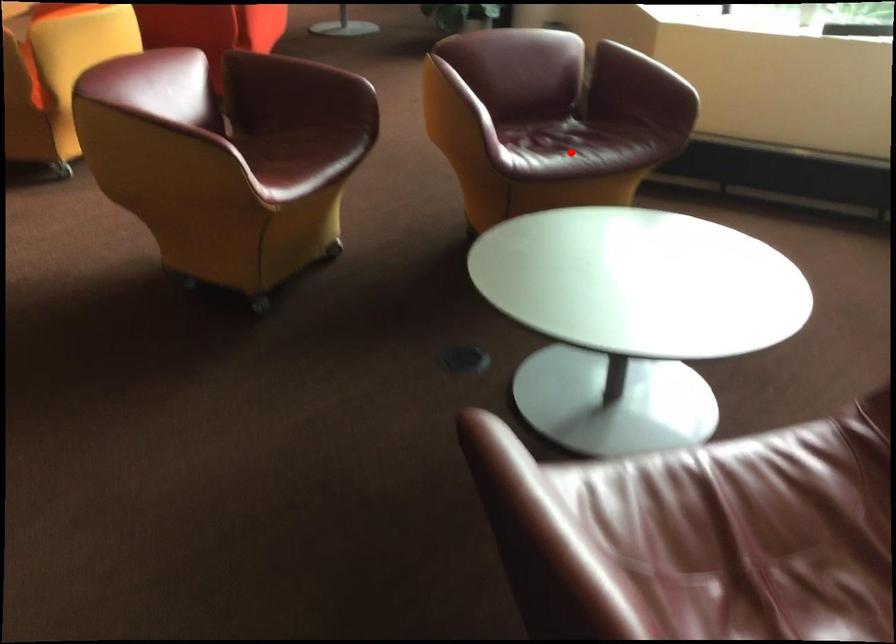
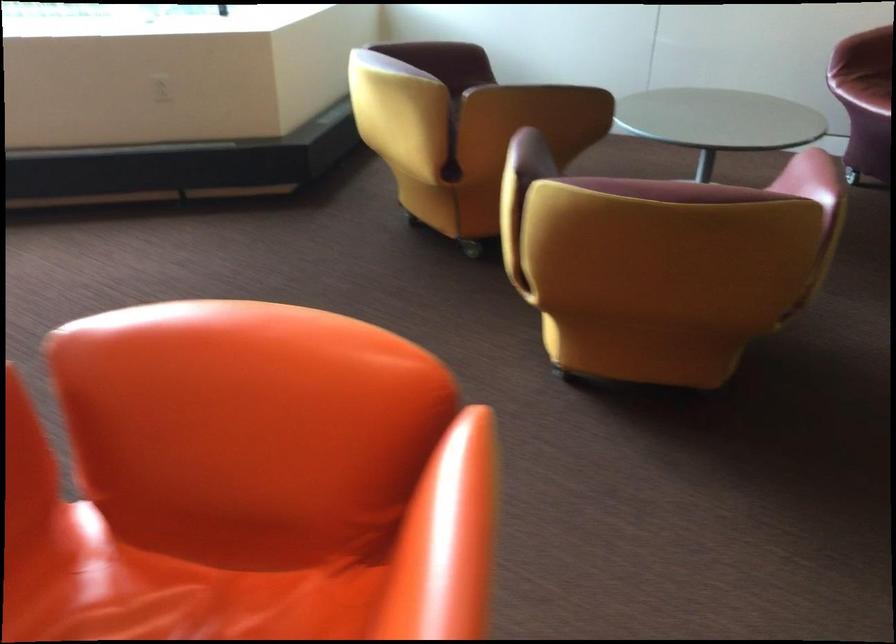
Question: I am providing you with two images of the same scene from different viewpoints. A red point is marked on the first image. Can you still see the location of the red point in image 2?

Choices:
 (A) Yes
 (B) No

Answer: (B)